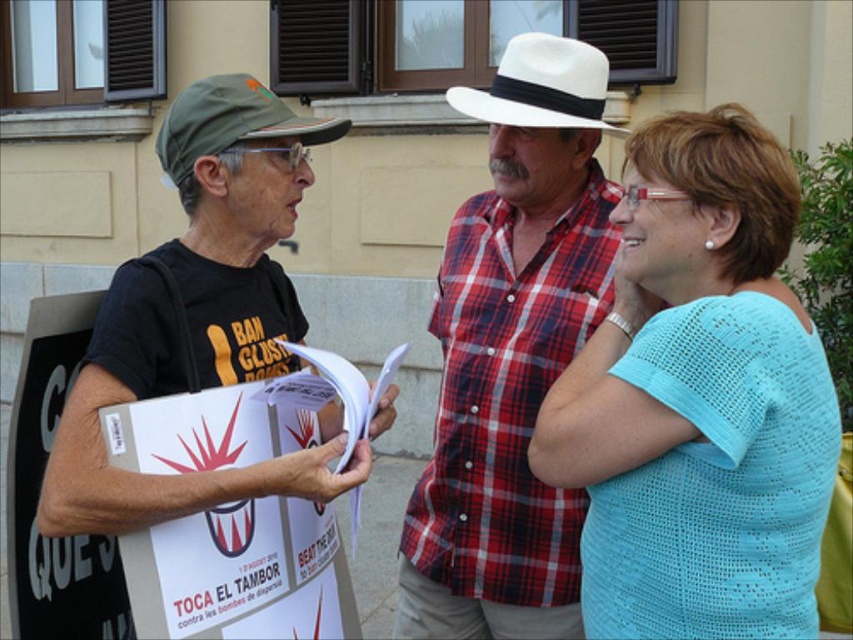
How far apart are white plaid shirt at center and white felt cowboy hat at upper center?

They are 15.67 inches apart.

You are a GUI agent. You are given a task and a screenshot of the screen. Output one action in this format:
    pyautogui.click(x=<x>, y=<y>)
    Task: Click on the white plaid shirt at center
    This screenshot has width=853, height=640.
    Given the screenshot: What is the action you would take?
    pyautogui.click(x=511, y=355)

Image resolution: width=853 pixels, height=640 pixels. Identify the location of white plaid shirt at center. (511, 355).

Does light blue knit shirt at center lie behind green fabric cap at left?

No, it is in front of green fabric cap at left.

The image size is (853, 640). Describe the element at coordinates (698, 397) in the screenshot. I see `light blue knit shirt at center` at that location.

Is point (660, 262) farther from viewer compared to point (190, 172)?

That is False.

The height and width of the screenshot is (640, 853). In order to click on light blue knit shirt at center in this screenshot , I will do `click(698, 397)`.

Between white plaid shirt at center and matte black t-shirt at left, which one has more height?

white plaid shirt at center

Does point (556, 632) come behind point (289, 221)?

Yes, point (556, 632) is farther from viewer.

I want to click on white plaid shirt at center, so click(x=511, y=355).